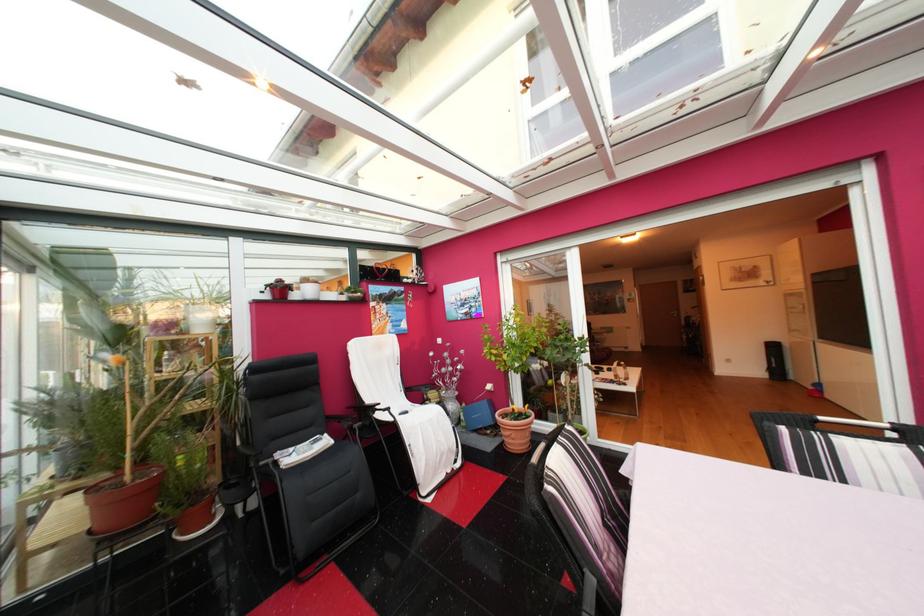
You are a GUI agent. You are given a task and a screenshot of the screen. Output one action in this format:
    pyautogui.click(x=<x>, y=<y>)
    Task: Click on the blue shoe box
    The width and height of the screenshot is (924, 616).
    Given the screenshot: What is the action you would take?
    pyautogui.click(x=478, y=415)